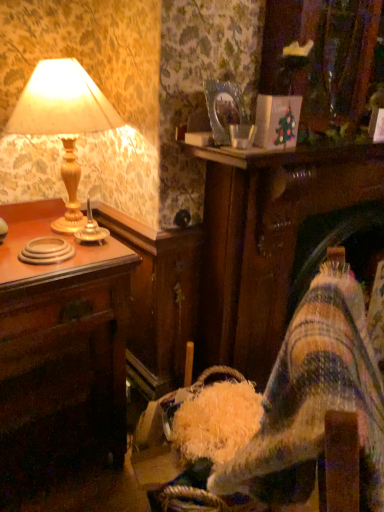
Where is `free point in front of gold metallic candle holder at left`? free point in front of gold metallic candle holder at left is located at coordinates point(87,256).